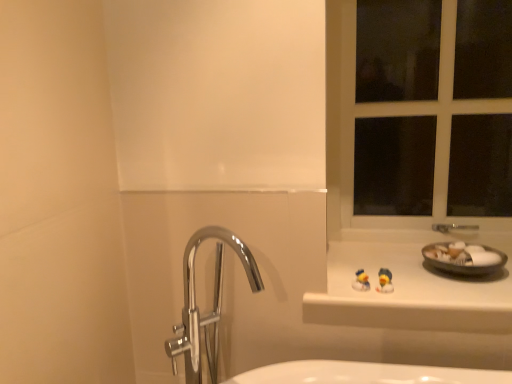
Describe the element at coordinates (361, 281) in the screenshot. Image resolution: width=512 pixels, height=384 pixels. I see `blue rubber duck at center, marked as the 2th miniature in a right-to-left arrangement` at that location.

In order to face white plastic window frame at upper right, should I rotate leftwards or rightwards?

Rotate right and turn 21.463 degrees.

What do you see at coordinates (408, 293) in the screenshot? I see `white glossy counter top at upper right` at bounding box center [408, 293].

Measure the distance between polished chrome tap at center and camera.

polished chrome tap at center is 37.02 inches away from camera.

You are a GUI agent. You are given a task and a screenshot of the screen. Output one action in this format:
    pyautogui.click(x=<x>, y=<y>)
    Task: Click on the blue rubber duck at center, marked as the 2th miniature in a right-to-left arrangement
    Image resolution: width=512 pixels, height=384 pixels.
    Given the screenshot: What is the action you would take?
    pyautogui.click(x=361, y=281)

Is white plastic window frame at upper right inside or outside of yellow rubber duck at center, the first miniature in the right-to-left sequence?

white plastic window frame at upper right is located beyond the bounds of yellow rubber duck at center, the first miniature in the right-to-left sequence.

Could you tell me if white plastic window frame at upper right is facing yellow rubber duck at center, the first miniature in the right-to-left sequence?

Yes, white plastic window frame at upper right is facing yellow rubber duck at center, the first miniature in the right-to-left sequence.

From the image's perspective, which object appears higher, white plastic window frame at upper right or yellow rubber duck at center, which appears as the second miniature when viewed from the left?

white plastic window frame at upper right.

Where is `the 1st miniature below when counting from the white plastic window frame at upper right (from the image's perspective)`? the 1st miniature below when counting from the white plastic window frame at upper right (from the image's perspective) is located at coordinates [385, 281].

Is white glossy counter top at upper right bigger than white plastic window frame at upper right?

Actually, white glossy counter top at upper right might be smaller than white plastic window frame at upper right.

Which of these two, white glossy counter top at upper right or white plastic window frame at upper right, stands shorter?

Standing shorter between the two is white glossy counter top at upper right.

In the scene shown: Is white glossy counter top at upper right turned away from white plastic window frame at upper right?

Absolutely, white glossy counter top at upper right is directed away from white plastic window frame at upper right.

Between white glossy counter top at upper right and white plastic window frame at upper right, which one has larger width?

white glossy counter top at upper right.

Which object is further away from the camera taking this photo, blue rubber duck at center, which appears as the 1th miniature when viewed from the left, or yellow rubber duck at center, which appears as the second miniature when viewed from the left?

Positioned behind is blue rubber duck at center, which appears as the 1th miniature when viewed from the left.

Can you confirm if blue rubber duck at center, marked as the 2th miniature in a right-to-left arrangement, is bigger than yellow rubber duck at center, the first miniature in the right-to-left sequence?

Correct, blue rubber duck at center, marked as the 2th miniature in a right-to-left arrangement, is larger in size than yellow rubber duck at center, the first miniature in the right-to-left sequence.

From the picture: Considering the positions of objects blue rubber duck at center, marked as the 2th miniature in a right-to-left arrangement, and yellow rubber duck at center, which appears as the second miniature when viewed from the left, in the image provided, who is more to the right, blue rubber duck at center, marked as the 2th miniature in a right-to-left arrangement, or yellow rubber duck at center, which appears as the second miniature when viewed from the left,?

From the viewer's perspective, yellow rubber duck at center, which appears as the second miniature when viewed from the left, appears more on the right side.

Considering the points (360, 280) and (385, 289), which point is in front, point (360, 280) or point (385, 289)?

The point (385, 289) is in front.

Can you tell me how much matte gray bowl at right and yellow rubber duck at center, which appears as the second miniature when viewed from the left, differ in facing direction?

2.7 degrees separate the facing orientations of matte gray bowl at right and yellow rubber duck at center, which appears as the second miniature when viewed from the left.

Find the location of `sink behind the yellow rubber duck at center, the first miniature in the right-to-left sequence`. sink behind the yellow rubber duck at center, the first miniature in the right-to-left sequence is located at coordinates (463, 258).

Consider the image. Which object is more forward, matte gray bowl at right or yellow rubber duck at center, which appears as the second miniature when viewed from the left?

yellow rubber duck at center, which appears as the second miniature when viewed from the left, is more forward.

Does matte gray bowl at right turn towards yellow rubber duck at center, which appears as the second miniature when viewed from the left?

No, matte gray bowl at right is not aimed at yellow rubber duck at center, which appears as the second miniature when viewed from the left.

Which object is positioned more to the left, polished chrome tap at center or white glossy counter top at upper right?

From the viewer's perspective, polished chrome tap at center appears more on the left side.

How far apart are polished chrome tap at center and white glossy counter top at upper right?

polished chrome tap at center and white glossy counter top at upper right are 19.49 inches apart.

Considering the sizes of objects polished chrome tap at center and white glossy counter top at upper right in the image provided, who is shorter, polished chrome tap at center or white glossy counter top at upper right?

white glossy counter top at upper right is shorter.

The image size is (512, 384). In order to click on counter top directly beneath the polished chrome tap at center (from a real-world perspective) in this screenshot , I will do click(x=408, y=293).

Can you see white plastic window frame at upper right touching matte gray bowl at right?

No, white plastic window frame at upper right is not next to matte gray bowl at right.

From the image's perspective, which is below, white plastic window frame at upper right or matte gray bowl at right?

matte gray bowl at right, from the image's perspective.

Would you say matte gray bowl at right is part of white plastic window frame at upper right's contents?

Definitely not — matte gray bowl at right is not inside white plastic window frame at upper right.

Considering their positions, is white plastic window frame at upper right located in front of or behind matte gray bowl at right?

white plastic window frame at upper right is behind matte gray bowl at right.

Is white glossy counter top at upper right inside the boundaries of polished chrome tap at center, or outside?

white glossy counter top at upper right is outside polished chrome tap at center.

From a real-world perspective, is white glossy counter top at upper right on polished chrome tap at center?

No, from a real-world perspective, white glossy counter top at upper right is not on top of polished chrome tap at center.

Is white glossy counter top at upper right positioned far away from polished chrome tap at center?

No, there isn't a large distance between white glossy counter top at upper right and polished chrome tap at center.

Between white glossy counter top at upper right and polished chrome tap at center, which one has smaller width?

Thinner between the two is polished chrome tap at center.

This screenshot has height=384, width=512. There is a white plastic window frame at upper right. In order to click on the 1st miniature below it (from the image's perspective) in this screenshot , I will do `click(385, 281)`.

You are a GUI agent. You are given a task and a screenshot of the screen. Output one action in this format:
    pyautogui.click(x=<x>, y=<y>)
    Task: Click on the counter top on the left of white plastic window frame at upper right
    The width and height of the screenshot is (512, 384).
    Given the screenshot: What is the action you would take?
    pyautogui.click(x=408, y=293)

Which object lies further to the anchor point yellow rubber duck at center, the first miniature in the right-to-left sequence, white glossy counter top at upper right or blue rubber duck at center, which appears as the 1th miniature when viewed from the left?

white glossy counter top at upper right is further to yellow rubber duck at center, the first miniature in the right-to-left sequence.

Considering their positions, is matte gray bowl at right positioned closer to white plastic window frame at upper right than yellow rubber duck at center, which appears as the second miniature when viewed from the left?

matte gray bowl at right is positioned closer to the anchor white plastic window frame at upper right.

Estimate the real-world distances between objects in this image. Which object is closer to white plastic window frame at upper right, white glossy counter top at upper right or yellow rubber duck at center, which appears as the second miniature when viewed from the left?

white glossy counter top at upper right.

Considering their positions, is yellow rubber duck at center, which appears as the second miniature when viewed from the left, positioned further to matte gray bowl at right than white glossy counter top at upper right?

The object further to matte gray bowl at right is yellow rubber duck at center, which appears as the second miniature when viewed from the left.

Considering their positions, is white glossy counter top at upper right positioned closer to polished chrome tap at center than blue rubber duck at center, which appears as the 1th miniature when viewed from the left?

Based on the image, white glossy counter top at upper right appears to be nearer to polished chrome tap at center.

From the image, which object appears to be farther from polished chrome tap at center, matte gray bowl at right or yellow rubber duck at center, the first miniature in the right-to-left sequence?

matte gray bowl at right is positioned further to the anchor polished chrome tap at center.

Based on their spatial positions, is white plastic window frame at upper right or polished chrome tap at center further from yellow rubber duck at center, the first miniature in the right-to-left sequence?

Among the two, white plastic window frame at upper right is located further to yellow rubber duck at center, the first miniature in the right-to-left sequence.

Based on their spatial positions, is white glossy counter top at upper right or white plastic window frame at upper right closer to yellow rubber duck at center, which appears as the second miniature when viewed from the left?

white glossy counter top at upper right is closer to yellow rubber duck at center, which appears as the second miniature when viewed from the left.

You are a GUI agent. You are given a task and a screenshot of the screen. Output one action in this format:
    pyautogui.click(x=<x>, y=<y>)
    Task: Click on the counter top between blue rubber duck at center, which appears as the 1th miniature when viewed from the left, and matte gray bowl at right
    
    Given the screenshot: What is the action you would take?
    pyautogui.click(x=408, y=293)

This screenshot has height=384, width=512. Find the location of `sink between white plastic window frame at upper right and yellow rubber duck at center, which appears as the second miniature when viewed from the left, vertically`. sink between white plastic window frame at upper right and yellow rubber duck at center, which appears as the second miniature when viewed from the left, vertically is located at coordinates (463, 258).

Where is `miniature located between blue rubber duck at center, which appears as the 1th miniature when viewed from the left, and white glossy counter top at upper right in the left-right direction`? miniature located between blue rubber duck at center, which appears as the 1th miniature when viewed from the left, and white glossy counter top at upper right in the left-right direction is located at coordinates (385, 281).

This screenshot has width=512, height=384. I want to click on sink between white plastic window frame at upper right and blue rubber duck at center, marked as the 2th miniature in a right-to-left arrangement, from top to bottom, so click(x=463, y=258).